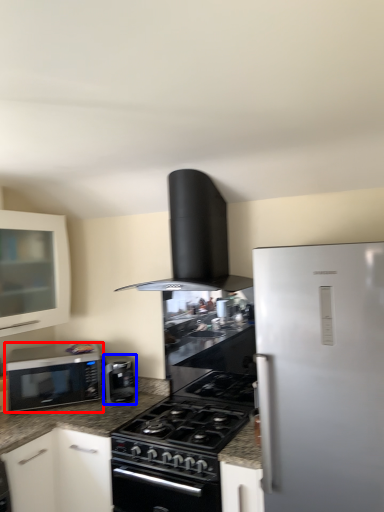
Question: Which object is closer to the camera taking this photo, microwave oven (highlighted by a red box) or kitchen appliance (highlighted by a blue box)?

Choices:
 (A) microwave oven
 (B) kitchen appliance

Answer: (A)